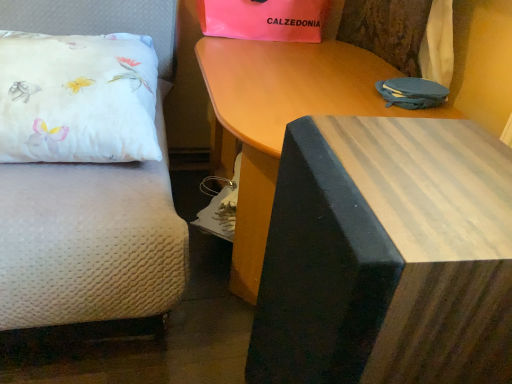
At what (x,y) coordinates should I click in order to perform the action: click on wooden table at center, the 1th table in the front-to-back sequence. Please return your answer as a coordinate pair (x, y). Image resolution: width=512 pixels, height=384 pixels. Looking at the image, I should click on (387, 255).

In order to face wooden table at upper center, which is the 2th table from front to back, should I rotate leftwards or rightwards?

Turn right by 6.801 degrees to look at wooden table at upper center, which is the 2th table from front to back.

What do you see at coordinates (282, 118) in the screenshot? I see `wooden table at upper center, marked as the first table in a back-to-front arrangement` at bounding box center [282, 118].

The width and height of the screenshot is (512, 384). What do you see at coordinates (264, 19) in the screenshot?
I see `pink matte gift bag at upper center` at bounding box center [264, 19].

Where is `wooden table at center, the 1th table in the front-to-back sequence`? The height and width of the screenshot is (384, 512). wooden table at center, the 1th table in the front-to-back sequence is located at coordinates (387, 255).

From a real-world perspective, which table is the 1st one underneath the white satin pillow at left? Please provide its 2D coordinates.

[(387, 255)]

Considering the relative sizes of white satin pillow at left and wooden table at center, the second table viewed from the back, in the image provided, is white satin pillow at left wider than wooden table at center, the second table viewed from the back,?

Indeed, white satin pillow at left has a greater width compared to wooden table at center, the second table viewed from the back.

How much distance is there between white satin pillow at left and wooden table at center, the 1th table in the front-to-back sequence?

21.78 inches.

From the image's perspective, between white satin pillow at left and wooden table at upper center, marked as the first table in a back-to-front arrangement, who is located below?

wooden table at upper center, marked as the first table in a back-to-front arrangement.

Can you confirm if white satin pillow at left is shorter than wooden table at upper center, which is the 2th table from front to back?

Yes, white satin pillow at left is shorter than wooden table at upper center, which is the 2th table from front to back.

Identify the location of table that is the 1st one when counting forward from the white satin pillow at left. (282, 118).

Relative to wooden table at upper center, which is the 2th table from front to back, is white satin pillow at left in front or behind?

Visually, white satin pillow at left is located behind wooden table at upper center, which is the 2th table from front to back.

Considering the positions of objects pink matte gift bag at upper center and white satin pillow at left in the image provided, who is in front, pink matte gift bag at upper center or white satin pillow at left?

white satin pillow at left is in front.

Considering the relative positions of pink matte gift bag at upper center and white satin pillow at left in the image provided, is pink matte gift bag at upper center to the left or to the right of white satin pillow at left?

Based on their positions, pink matte gift bag at upper center is located to the right of white satin pillow at left.

In terms of size, does pink matte gift bag at upper center appear bigger or smaller than white satin pillow at left?

In the image, pink matte gift bag at upper center appears to be smaller than white satin pillow at left.

Could you tell me if pink matte gift bag at upper center is turned towards white satin pillow at left?

No, pink matte gift bag at upper center is not facing towards white satin pillow at left.

From a real-world perspective, is pink matte gift bag at upper center above or below wooden table at upper center, which is the 2th table from front to back?

pink matte gift bag at upper center is above wooden table at upper center, which is the 2th table from front to back.

Based on the photo, is pink matte gift bag at upper center not close to wooden table at upper center, which is the 2th table from front to back?

That's not correct — pink matte gift bag at upper center is a little close to wooden table at upper center, which is the 2th table from front to back.

In terms of height, does pink matte gift bag at upper center look taller or shorter compared to wooden table at upper center, which is the 2th table from front to back?

In the image, pink matte gift bag at upper center appears to be shorter than wooden table at upper center, which is the 2th table from front to back.

Considering the sizes of objects pink matte gift bag at upper center and wooden table at center, the 1th table in the front-to-back sequence, in the image provided, who is bigger, pink matte gift bag at upper center or wooden table at center, the 1th table in the front-to-back sequence,?

wooden table at center, the 1th table in the front-to-back sequence.

From the picture: In the image, is pink matte gift bag at upper center positioned in front of or behind wooden table at center, the 1th table in the front-to-back sequence?

Visually, pink matte gift bag at upper center is located behind wooden table at center, the 1th table in the front-to-back sequence.

Could white satin pillow at left be considered to be inside wooden table at center, the 1th table in the front-to-back sequence?

No, white satin pillow at left is not surrounded by wooden table at center, the 1th table in the front-to-back sequence.

Is wooden table at center, the second table viewed from the back, oriented away from white satin pillow at left?

No, wooden table at center, the second table viewed from the back,'s orientation is not away from white satin pillow at left.

From a real-world perspective, between wooden table at center, the second table viewed from the back, and white satin pillow at left, who is vertically higher?

white satin pillow at left, from a real-world perspective.

Who is shorter, wooden table at center, the 1th table in the front-to-back sequence, or white satin pillow at left?

Standing shorter between the two is white satin pillow at left.

Between wooden table at center, the second table viewed from the back, and wooden table at upper center, which is the 2th table from front to back, which one is positioned in front?

wooden table at center, the second table viewed from the back, is more forward.

Considering the positions of point (451, 289) and point (273, 129), is point (451, 289) closer or farther from the camera than point (273, 129)?

Point (451, 289) is closer to the camera than point (273, 129).

Image resolution: width=512 pixels, height=384 pixels. I want to click on table on the left of wooden table at center, the second table viewed from the back, so click(x=282, y=118).

Based on the photo, which object is thinner, wooden table at center, the second table viewed from the back, or wooden table at upper center, marked as the first table in a back-to-front arrangement?

wooden table at center, the second table viewed from the back.

Find the location of a particular element. The image size is (512, 384). pillow located above the wooden table at center, the second table viewed from the back (from the image's perspective) is located at coordinates (77, 98).

You are a GUI agent. You are given a task and a screenshot of the screen. Output one action in this format:
    pyautogui.click(x=<x>, y=<y>)
    Task: Click on the 2nd table directly beneath the white satin pillow at left (from a real-world perspective)
    The height and width of the screenshot is (384, 512).
    Given the screenshot: What is the action you would take?
    pyautogui.click(x=282, y=118)

Looking at this image, from the image, which object appears to be farther from wooden table at upper center, which is the 2th table from front to back, pink matte gift bag at upper center or wooden table at center, the second table viewed from the back?

Among the two, wooden table at center, the second table viewed from the back, is located further to wooden table at upper center, which is the 2th table from front to back.

Looking at the image, which one is located further to white satin pillow at left, wooden table at upper center, marked as the first table in a back-to-front arrangement, or wooden table at center, the second table viewed from the back?

Based on the image, wooden table at center, the second table viewed from the back, appears to be further to white satin pillow at left.

Based on their spatial positions, is white satin pillow at left or wooden table at center, the second table viewed from the back, closer to pink matte gift bag at upper center?

white satin pillow at left.

Estimate the real-world distances between objects in this image. Which object is closer to pink matte gift bag at upper center, wooden table at center, the second table viewed from the back, or white satin pillow at left?

white satin pillow at left is closer to pink matte gift bag at upper center.

Considering their positions, is pink matte gift bag at upper center positioned closer to white satin pillow at left than wooden table at center, the second table viewed from the back?

pink matte gift bag at upper center is closer to white satin pillow at left.

Looking at the image, which one is located closer to white satin pillow at left, wooden table at center, the second table viewed from the back, or pink matte gift bag at upper center?

pink matte gift bag at upper center is positioned closer to the anchor white satin pillow at left.

Considering their positions, is white satin pillow at left positioned further to pink matte gift bag at upper center than wooden table at upper center, marked as the first table in a back-to-front arrangement?

Among the two, white satin pillow at left is located further to pink matte gift bag at upper center.

Considering their positions, is wooden table at upper center, marked as the first table in a back-to-front arrangement, positioned closer to wooden table at center, the 1th table in the front-to-back sequence, than white satin pillow at left?

Based on the image, wooden table at upper center, marked as the first table in a back-to-front arrangement, appears to be nearer to wooden table at center, the 1th table in the front-to-back sequence.

Locate an element on the screen. pillow located between wooden table at upper center, marked as the first table in a back-to-front arrangement, and pink matte gift bag at upper center in the depth direction is located at coordinates (77, 98).

You are a GUI agent. You are given a task and a screenshot of the screen. Output one action in this format:
    pyautogui.click(x=<x>, y=<y>)
    Task: Click on the table between white satin pillow at left and wooden table at center, the second table viewed from the back
    This screenshot has height=384, width=512.
    Given the screenshot: What is the action you would take?
    pyautogui.click(x=282, y=118)

The height and width of the screenshot is (384, 512). Find the location of `table between wooden table at center, the 1th table in the front-to-back sequence, and pink matte gift bag at upper center, along the z-axis`. table between wooden table at center, the 1th table in the front-to-back sequence, and pink matte gift bag at upper center, along the z-axis is located at coordinates (282, 118).

Find the location of a particular element. pillow located between wooden table at center, the second table viewed from the back, and pink matte gift bag at upper center in the depth direction is located at coordinates (77, 98).